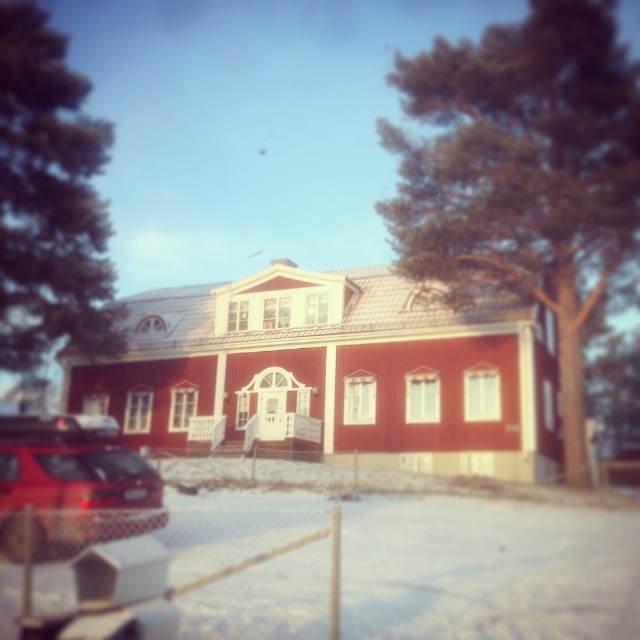
Is green textured tree at upper right further to camera compared to green textured tree at upper left?

No.

Identify the location of green textured tree at upper right. The height and width of the screenshot is (640, 640). (524, 172).

Image resolution: width=640 pixels, height=640 pixels. What do you see at coordinates (524, 172) in the screenshot? I see `green textured tree at upper right` at bounding box center [524, 172].

Locate an element on the screen. The width and height of the screenshot is (640, 640). green textured tree at upper right is located at coordinates (524, 172).

Is green textured tree at upper left wider than shiny red car at lower left?

Yes, green textured tree at upper left is wider than shiny red car at lower left.

Can you confirm if green textured tree at upper left is thinner than shiny red car at lower left?

In fact, green textured tree at upper left might be wider than shiny red car at lower left.

Identify the location of green textured tree at upper left. The width and height of the screenshot is (640, 640). (49, 198).

Which is more to the left, green textured tree at upper right or shiny red car at lower left?

shiny red car at lower left is more to the left.

Can you confirm if green textured tree at upper right is positioned to the right of shiny red car at lower left?

Yes, green textured tree at upper right is to the right of shiny red car at lower left.

What do you see at coordinates (524, 172) in the screenshot? I see `green textured tree at upper right` at bounding box center [524, 172].

Find the location of a particular element. The image size is (640, 640). green textured tree at upper right is located at coordinates tap(524, 172).